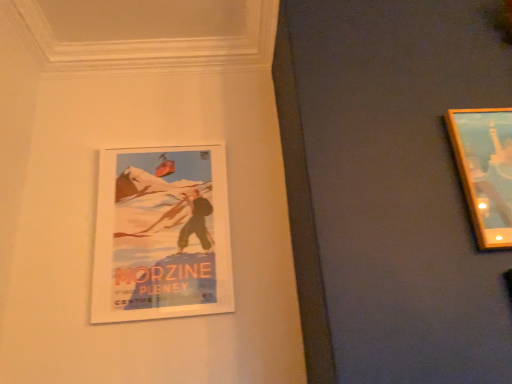
What do you see at coordinates (162, 234) in the screenshot? The height and width of the screenshot is (384, 512). I see `matte paper poster at upper left` at bounding box center [162, 234].

Where is `matte paper poster at upper left`? matte paper poster at upper left is located at coordinates (162, 234).

Find the location of `matte paper poster at upper left`. matte paper poster at upper left is located at coordinates (162, 234).